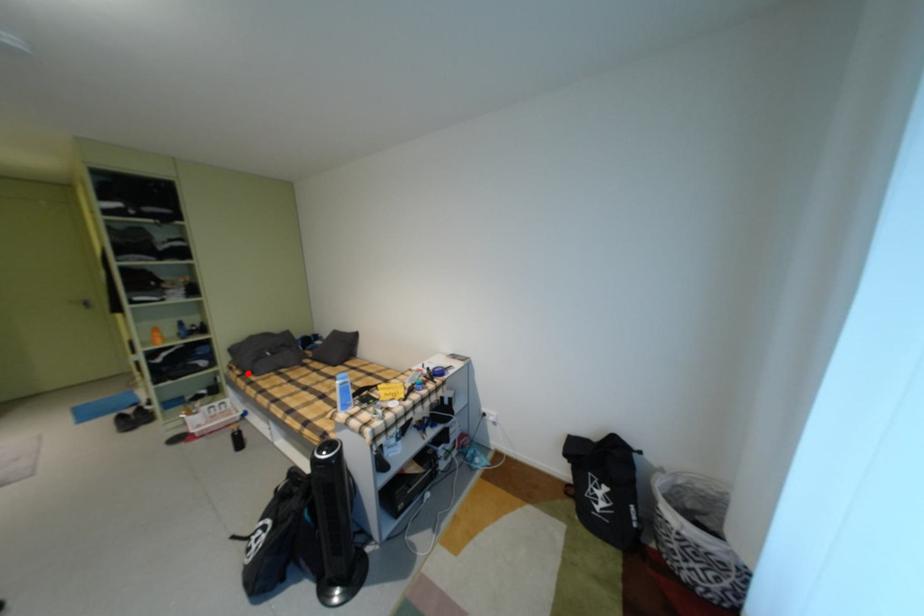
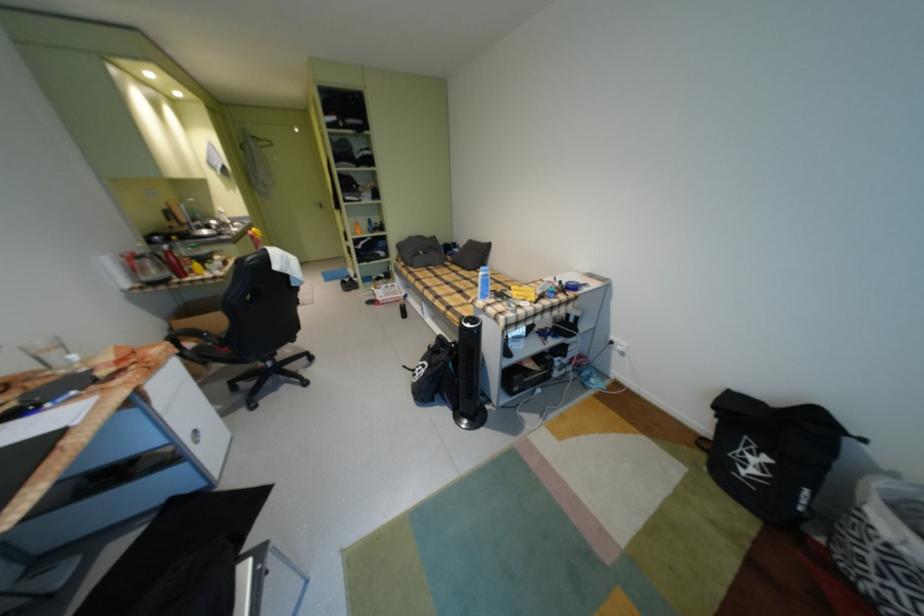
Find the pixel in the second image that matches the highlighted location in the first image.

(412, 265)